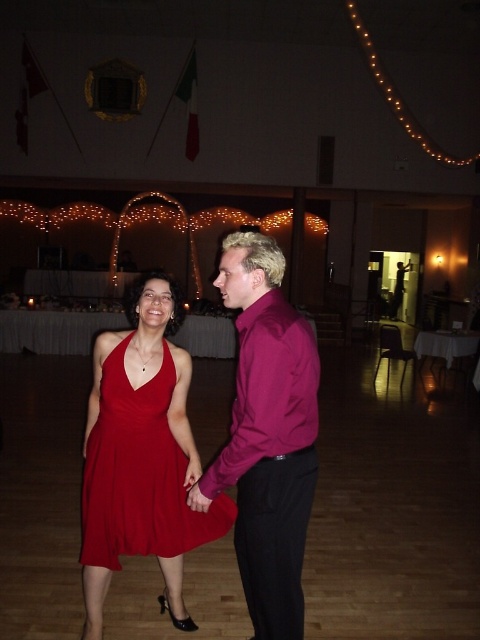
You are a photographer at the event and need to position a spotlight so that it illuminates both the shiny magenta shirt at center and the purple satin shirt at center without casting shadows on the guests behind them. Given that the spotlight can only be angled downward from above, which shirt should you aim the spotlight at first to ensure both are lit properly?

The shiny magenta shirt at center is taller than the purple satin shirt at center, so you should aim the spotlight at the shiny magenta shirt at center first. This ensures that the taller shirt is properly illuminated, and the light will naturally reach the shorter purple satin shirt at center below it without casting shadows on the guests behind.

You are a photographer positioned at the entrance of the banquet hall. You need to capture a photo of the matte red dress at center. Based on the coordinates provided, where should you aim your camera to ensure the dress is centered in the frame?

The matte red dress at center is located at coordinates point [140,474], so you should aim your camera at that point to center it in the frame.

You are standing at the point labeled point (288,308) and want to walk to the exit located at point (273,456). Is the exit directly in front of you, or do you need to move sideways?

The exit at point (273,456) is directly in front of you because it is positioned in front of your current location at point (288,308).